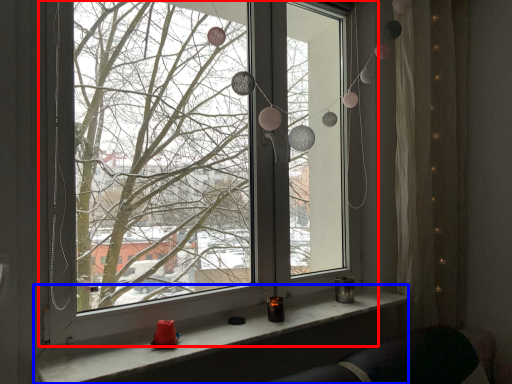
Question: Among these objects, which one is farthest to the camera, window (highlighted by a red box) or window sill (highlighted by a blue box)?

Choices:
 (A) window
 (B) window sill

Answer: (A)